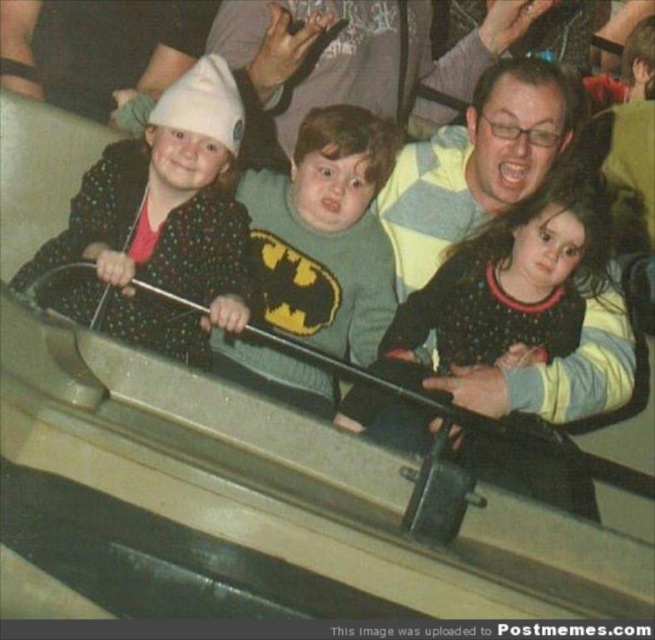
Question: Is white dotted sweater at left below polka dot sweater at center?

Choices:
 (A) no
 (B) yes

Answer: (A)

Question: Estimate the real-world distances between objects in this image. Which object is farther from the white dotted sweater at left?

Choices:
 (A) green knitted sweater at center
 (B) polka dot sweater at center

Answer: (B)

Question: Which object is positioned closest to the white dotted sweater at left?

Choices:
 (A) green knitted sweater at center
 (B) polka dot sweater at center

Answer: (A)

Question: Which object appears closest to the camera in this image?

Choices:
 (A) white dotted sweater at left
 (B) green knitted sweater at center

Answer: (A)

Question: Is polka dot sweater at center above green knitted sweater at center?

Choices:
 (A) yes
 (B) no

Answer: (B)

Question: Considering the relative positions of white dotted sweater at left and polka dot sweater at center in the image provided, where is white dotted sweater at left located with respect to polka dot sweater at center?

Choices:
 (A) above
 (B) below

Answer: (A)